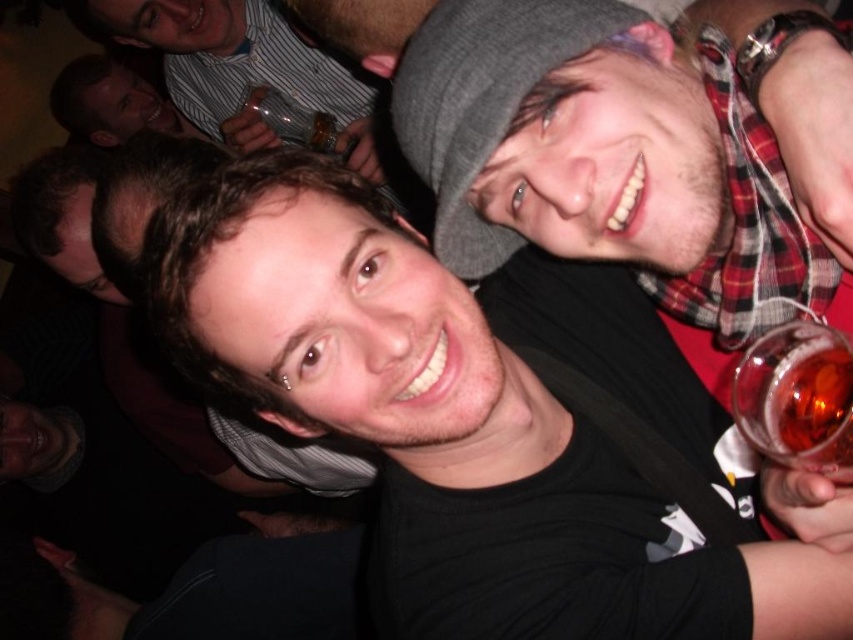
Question: Does black matte shirt at center have a smaller size compared to translucent glass wine at right?

Choices:
 (A) yes
 (B) no

Answer: (B)

Question: Does striped shirt at upper left appear on the right side of dark brown leather jacket at upper left?

Choices:
 (A) yes
 (B) no

Answer: (A)

Question: Considering the relative positions of black matte shirt at center and striped shirt at upper left in the image provided, where is black matte shirt at center located with respect to striped shirt at upper left?

Choices:
 (A) left
 (B) right

Answer: (B)

Question: Which point appears farthest from the camera in this image?

Choices:
 (A) (206, 376)
 (B) (758, 420)
 (C) (260, 129)
 (D) (97, 125)

Answer: (D)

Question: Which point is farther to the camera?

Choices:
 (A) black matte shirt at center
 (B) translucent glass wine at right
 (C) dark brown leather jacket at upper left
 (D) striped shirt at upper left

Answer: (C)

Question: Estimate the real-world distances between objects in this image. Which object is closer to the black matte shirt at center?

Choices:
 (A) striped shirt at upper left
 (B) dark brown leather jacket at upper left
 (C) translucent glass wine at right

Answer: (C)